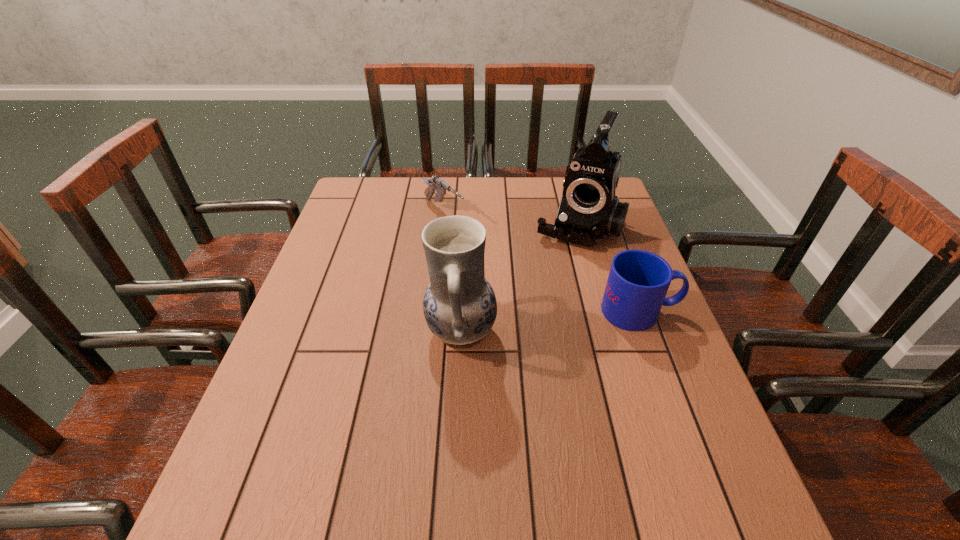
Image resolution: width=960 pixels, height=540 pixels. I want to click on object that stands as the second closest to the gun, so pyautogui.click(x=459, y=305).

Locate an element on the screen. The image size is (960, 540). free space that satisfies the following two spatial constraints: 1. on the back side of the camcorder; 2. on the left side of the pottery is located at coordinates (x=466, y=227).